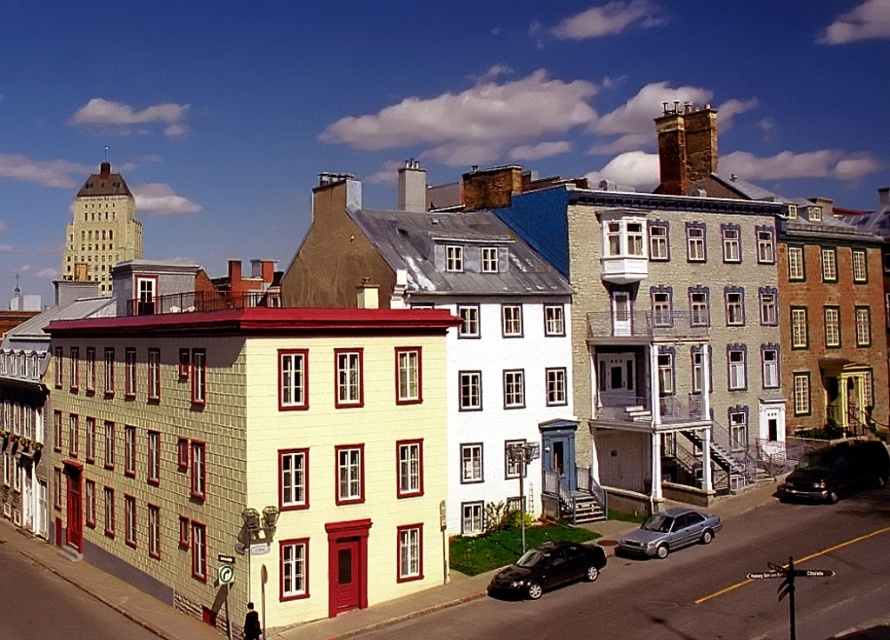
Question: Is shiny black van at lower right thinner than metallic silver sedan at center?

Choices:
 (A) no
 (B) yes

Answer: (A)

Question: Which point is closer to the camera taking this photo?

Choices:
 (A) (x=858, y=488)
 (B) (x=641, y=529)
 (C) (x=597, y=557)

Answer: (C)

Question: Which of these objects is positioned closest to the shiny black sedan at lower center?

Choices:
 (A) shiny black van at lower right
 (B) metallic silver sedan at center

Answer: (B)

Question: Which point is farther to the camera?

Choices:
 (A) metallic silver sedan at center
 (B) shiny black sedan at lower center
 (C) shiny black van at lower right

Answer: (C)

Question: Where is shiny black van at lower right located in relation to shiny black sedan at lower center in the image?

Choices:
 (A) right
 (B) left

Answer: (A)

Question: Observing the image, what is the correct spatial positioning of shiny black sedan at lower center in reference to metallic silver sedan at center?

Choices:
 (A) right
 (B) left

Answer: (B)